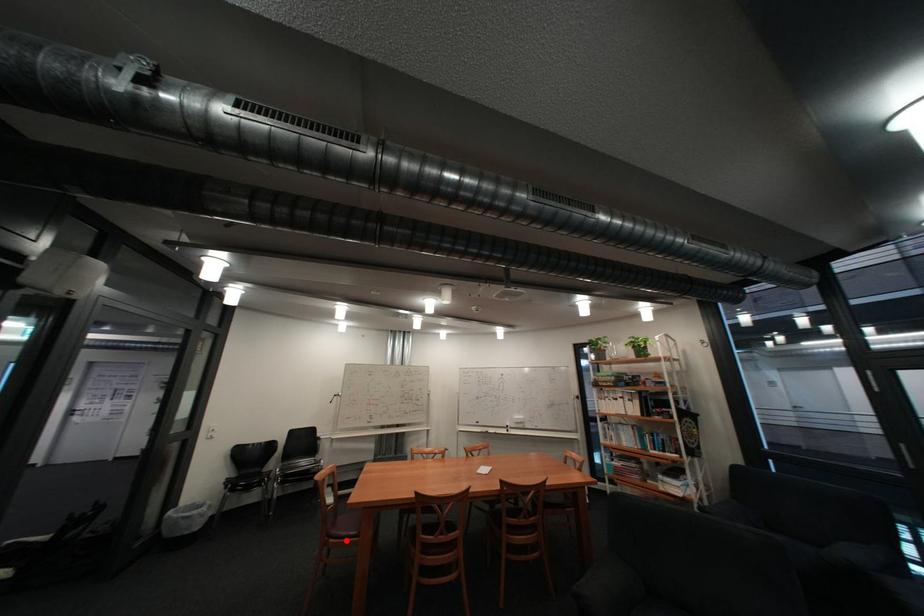
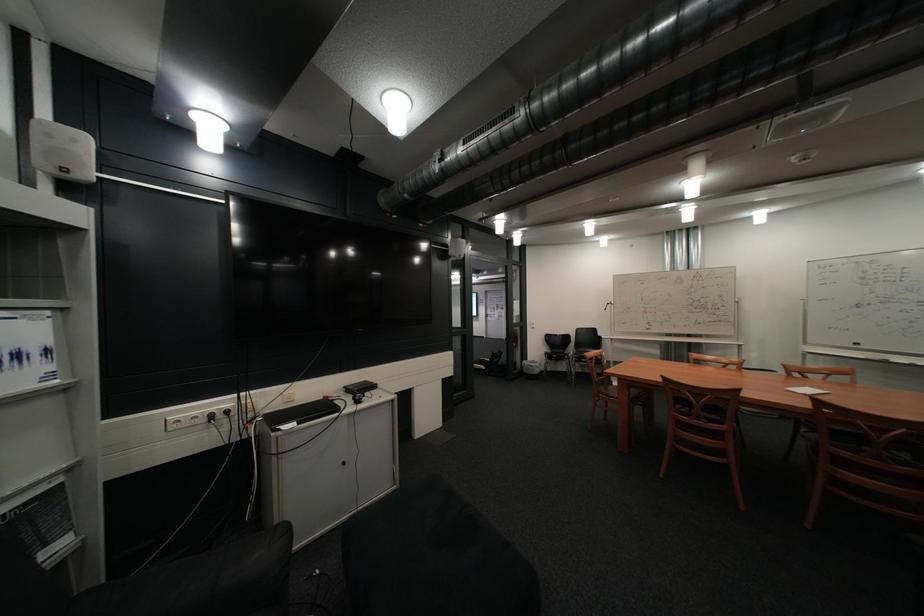
Question: I am providing you with two images of the same scene from different viewpoints. Image1 has a red point marked. In image2, the corresponding 3D location appears at what relative position? Reply with the corresponding letter.

Choices:
 (A) Closer
 (B) Farther

Answer: (A)